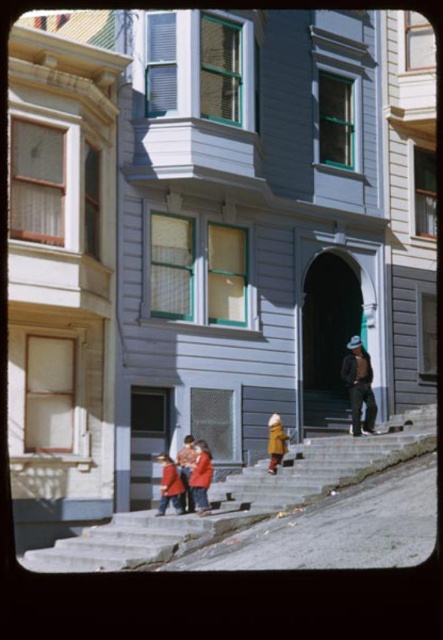
Is red wool coat at lower center positioned in front of yellow wool coat at center?

That is True.

Describe the element at coordinates (170, 484) in the screenshot. Image resolution: width=443 pixels, height=640 pixels. I see `red wool coat at lower center` at that location.

Locate an element on the screen. Image resolution: width=443 pixels, height=640 pixels. red wool coat at lower center is located at coordinates (170, 484).

Who is more distant from viewer, (352, 419) or (279, 426)?

The point (352, 419) is behind.

Which is in front, point (357, 348) or point (275, 420)?

Positioned in front is point (275, 420).

Does point (369, 419) lie in front of point (278, 438)?

No, it is not.

Find the location of a particular element. The image size is (443, 640). dark brown leather jacket at center is located at coordinates (358, 387).

Does concrete stairs at center have a greater width compared to yellow wool coat at center?

Correct, the width of concrete stairs at center exceeds that of yellow wool coat at center.

Between point (383, 444) and point (276, 458), which one is positioned behind?

The point (276, 458) is more distant.

Describe the element at coordinates (241, 499) in the screenshot. I see `concrete stairs at center` at that location.

This screenshot has height=640, width=443. I want to click on concrete stairs at center, so click(x=241, y=499).